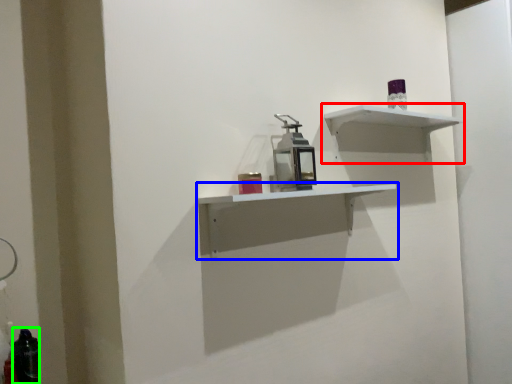
Question: Which object is the farthest from shelf (highlighted by a red box)? Choose among these: shelf (highlighted by a blue box) or bottle (highlighted by a green box).

Choices:
 (A) shelf
 (B) bottle

Answer: (B)